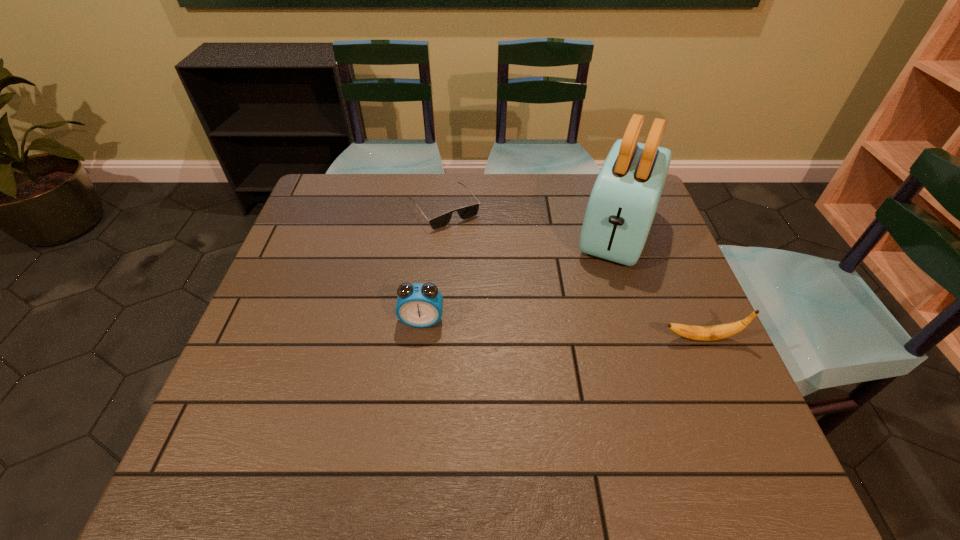
Find the location of `vacant area between the third farthest object and the nearest object`. vacant area between the third farthest object and the nearest object is located at coordinates (562, 329).

Find the location of a particular element. free space between the third shortest object and the tallest object is located at coordinates (519, 276).

At what (x,y) coordinates should I click in order to perform the action: click on vacant area that lies between the second shortest object and the toaster. Please return your answer as a coordinate pair (x, y). Looking at the image, I should click on (660, 285).

Where is `empty location between the third farthest object and the toaster`? empty location between the third farthest object and the toaster is located at coordinates (519, 276).

Locate an element on the screen. vacant space that's between the toaster and the third shortest object is located at coordinates (519, 276).

This screenshot has height=540, width=960. Find the location of `free space between the third farthest object and the shortest object`. free space between the third farthest object and the shortest object is located at coordinates (433, 265).

Where is `vacant area that lies between the nearest object and the toaster`? vacant area that lies between the nearest object and the toaster is located at coordinates (660, 285).

Find the location of a particular element. the third closest object to the third shortest object is located at coordinates (702, 333).

Image resolution: width=960 pixels, height=540 pixels. I want to click on the third closest object to the shortest object, so (x=702, y=333).

Where is `free region that satisfies the following two spatial constraints: 1. on the front side of the tallest object; 2. on the peel of the banana from the top`? The height and width of the screenshot is (540, 960). free region that satisfies the following two spatial constraints: 1. on the front side of the tallest object; 2. on the peel of the banana from the top is located at coordinates (652, 338).